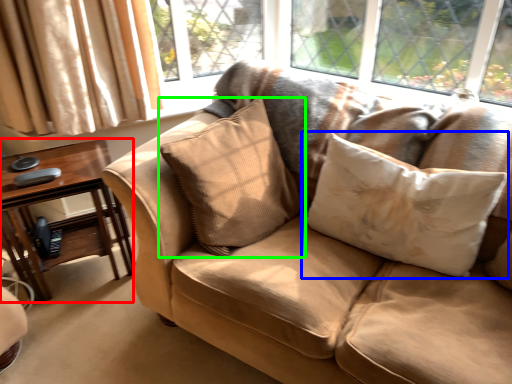
Question: Which object is positioned farthest from table (highlighted by a red box)? Select from pillow (highlighted by a blue box) and pillow (highlighted by a green box).

Choices:
 (A) pillow
 (B) pillow

Answer: (A)